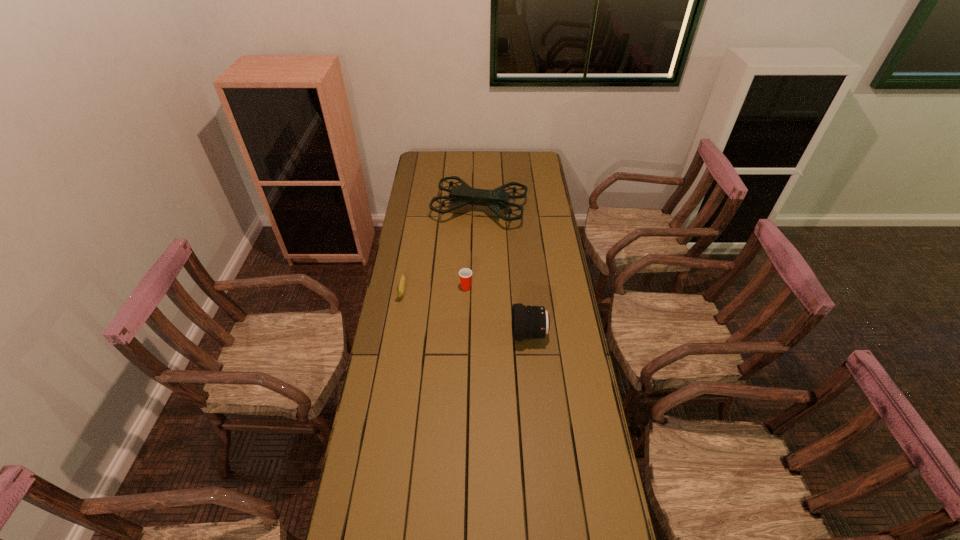
Find the location of `the tallest object`. the tallest object is located at coordinates (461, 195).

At what (x,y) coordinates should I click in order to perform the action: click on the farthest object. Please return your answer as a coordinate pair (x, y). The height and width of the screenshot is (540, 960). Looking at the image, I should click on (461, 195).

Where is `the third shortest object`? the third shortest object is located at coordinates (528, 322).

Where is `the nearest object`? the nearest object is located at coordinates (528, 322).

Identify the location of the leftmost object. coord(400,291).

At what (x,y) coordinates should I click in order to perform the action: click on Dixie cup. Please return your answer as a coordinate pair (x, y). The width and height of the screenshot is (960, 540). Looking at the image, I should click on (465, 274).

Image resolution: width=960 pixels, height=540 pixels. Identify the location of vacant area situated 0.070m on the front of the tallest object. [479, 241].

Identify the location of vacant region located 0.160m at the front element of the telephoto lens. (470, 334).

Where is `free space located 0.210m at the front element of the telephoto lens`? The width and height of the screenshot is (960, 540). free space located 0.210m at the front element of the telephoto lens is located at coordinates (457, 334).

Find the location of a particular element. Image resolution: width=960 pixels, height=540 pixels. free space located 0.280m at the front element of the telephoto lens is located at coordinates (439, 334).